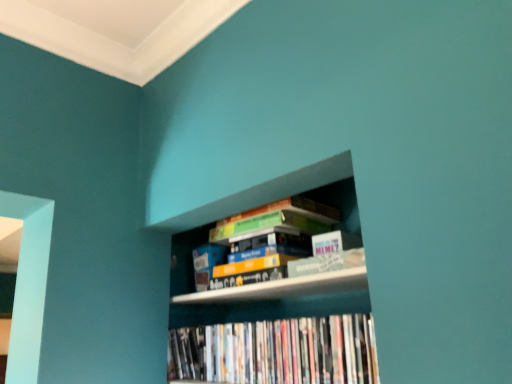
Question: Does hardcover books at upper center, the second book in the bottom-to-top sequence, appear on the right side of white glossy dvds at lower center, which ranks as the first book in bottom-to-top order?

Choices:
 (A) no
 (B) yes

Answer: (B)

Question: Is hardcover books at upper center, the second book in the bottom-to-top sequence, bigger than white glossy dvds at lower center, which ranks as the 2th book in top-to-bottom order?

Choices:
 (A) yes
 (B) no

Answer: (A)

Question: From the image's perspective, does hardcover books at upper center, the second book in the bottom-to-top sequence, appear higher than white glossy dvds at lower center, which ranks as the first book in bottom-to-top order?

Choices:
 (A) no
 (B) yes

Answer: (B)

Question: Is hardcover books at upper center, the first book in the top-to-bottom sequence, facing away from white glossy dvds at lower center, which ranks as the 2th book in top-to-bottom order?

Choices:
 (A) yes
 (B) no

Answer: (B)

Question: Does hardcover books at upper center, the first book in the top-to-bottom sequence, come behind white glossy dvds at lower center, which ranks as the 2th book in top-to-bottom order?

Choices:
 (A) yes
 (B) no

Answer: (A)

Question: In terms of height, does wooden bookshelf at center look taller or shorter compared to white glossy dvds at lower center, which ranks as the first book in bottom-to-top order?

Choices:
 (A) tall
 (B) short

Answer: (A)

Question: Visually, is wooden bookshelf at center positioned to the left or to the right of white glossy dvds at lower center, which ranks as the first book in bottom-to-top order?

Choices:
 (A) right
 (B) left

Answer: (A)

Question: Considering their positions, is wooden bookshelf at center located in front of or behind white glossy dvds at lower center, which ranks as the 2th book in top-to-bottom order?

Choices:
 (A) behind
 (B) front

Answer: (B)

Question: From a real-world perspective, is wooden bookshelf at center physically located above or below white glossy dvds at lower center, which ranks as the 2th book in top-to-bottom order?

Choices:
 (A) below
 (B) above

Answer: (B)

Question: From the image's perspective, is wooden bookshelf at center above or below hardcover books at upper center, the second book in the bottom-to-top sequence?

Choices:
 (A) below
 (B) above

Answer: (A)

Question: Is wooden bookshelf at center taller or shorter than hardcover books at upper center, the first book in the top-to-bottom sequence?

Choices:
 (A) tall
 (B) short

Answer: (A)

Question: From a real-world perspective, is wooden bookshelf at center positioned above or below hardcover books at upper center, the second book in the bottom-to-top sequence?

Choices:
 (A) below
 (B) above

Answer: (A)

Question: Is wooden bookshelf at center spatially inside hardcover books at upper center, the first book in the top-to-bottom sequence, or outside of it?

Choices:
 (A) outside
 (B) inside

Answer: (A)

Question: Looking at their shapes, would you say hardcover books at upper center, the second book in the bottom-to-top sequence, is wider or thinner than white glossy dvds at lower center, which ranks as the 2th book in top-to-bottom order?

Choices:
 (A) wide
 (B) thin

Answer: (A)

Question: Is point click(x=294, y=203) closer or farther from the camera than point click(x=376, y=379)?

Choices:
 (A) closer
 (B) farther

Answer: (B)